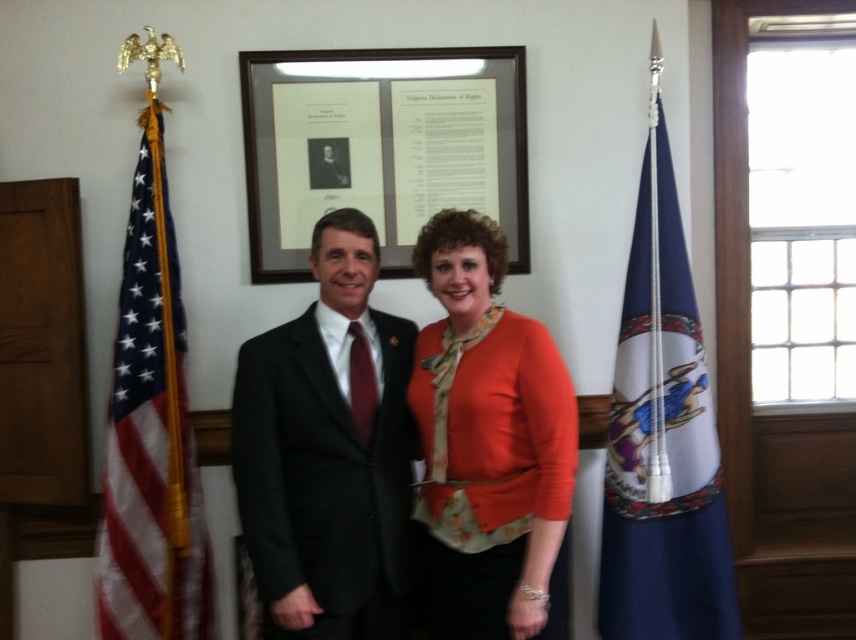
Is the position of orange matte sweater at center less distant than that of blue fabric flag at right?

Yes, orange matte sweater at center is in front of blue fabric flag at right.

Does point (474, 604) come in front of point (628, 467)?

Yes, it is.

Between point (471, 548) and point (687, 536), which one is positioned behind?

The point (687, 536) is behind.

Where is `orange matte sweater at center`? The height and width of the screenshot is (640, 856). orange matte sweater at center is located at coordinates (489, 444).

Who is higher up, blue fabric flag at right or blue fabric flag at left?

blue fabric flag at right

Is blue fabric flag at right in front of blue fabric flag at left?

No, it is not.

Is point (623, 564) positioned before point (134, 396)?

That is False.

At what (x,y) coordinates should I click in order to perform the action: click on blue fabric flag at right. Please return your answer as a coordinate pair (x, y). Looking at the image, I should click on (666, 449).

Identify the location of dark gray suit at center. (330, 451).

Is dark gray suit at center to the left of orange matte sweater at center from the viewer's perspective?

Correct, you'll find dark gray suit at center to the left of orange matte sweater at center.

Which is behind, point (277, 468) or point (477, 461)?

The point (277, 468) is more distant.

Where is `dark gray suit at center`? dark gray suit at center is located at coordinates (330, 451).